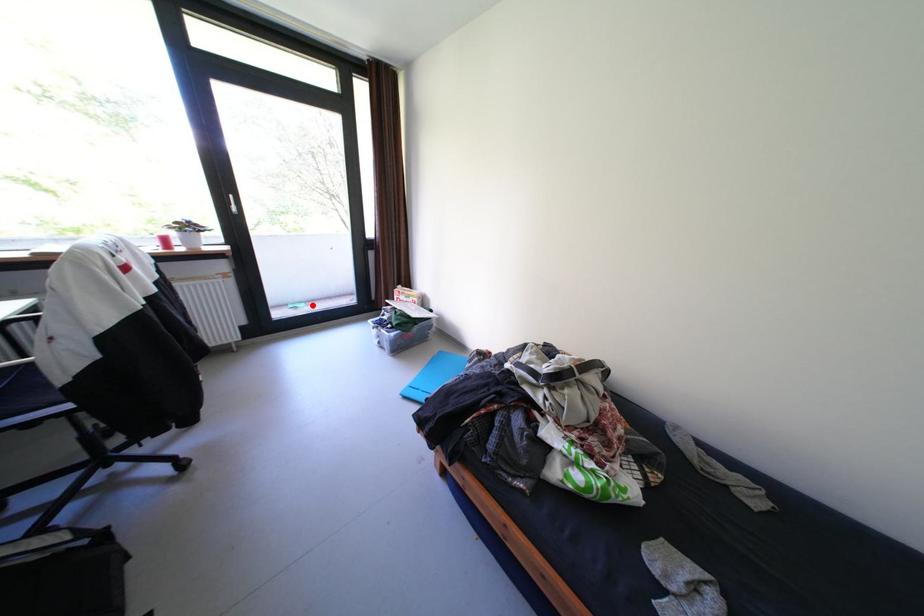
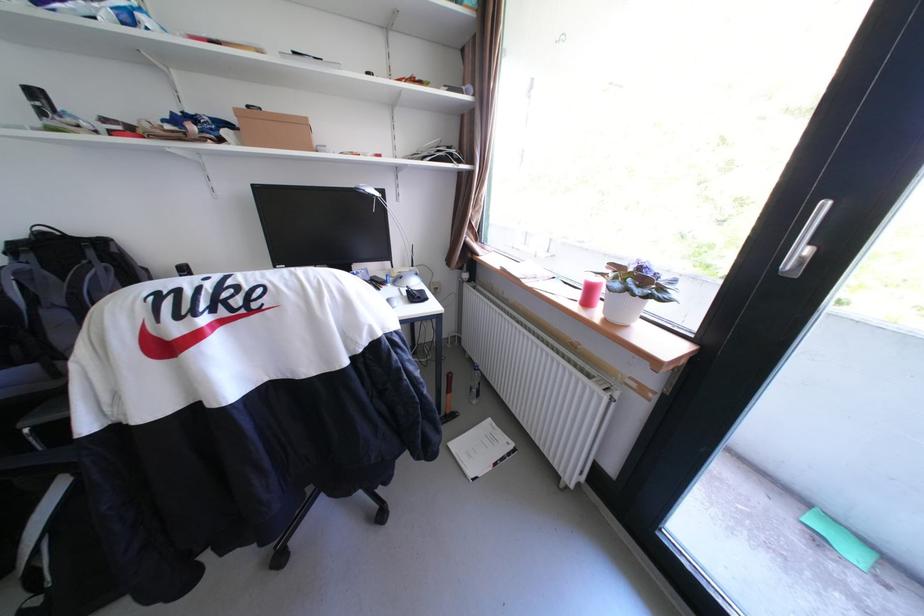
Question: I am providing you with two images of the same scene from different viewpoints. In image1, a red point is highlighted. Considering the same 3D point in image2, which of the following is correct?

Choices:
 (A) It is closer
 (B) It is farther

Answer: (A)